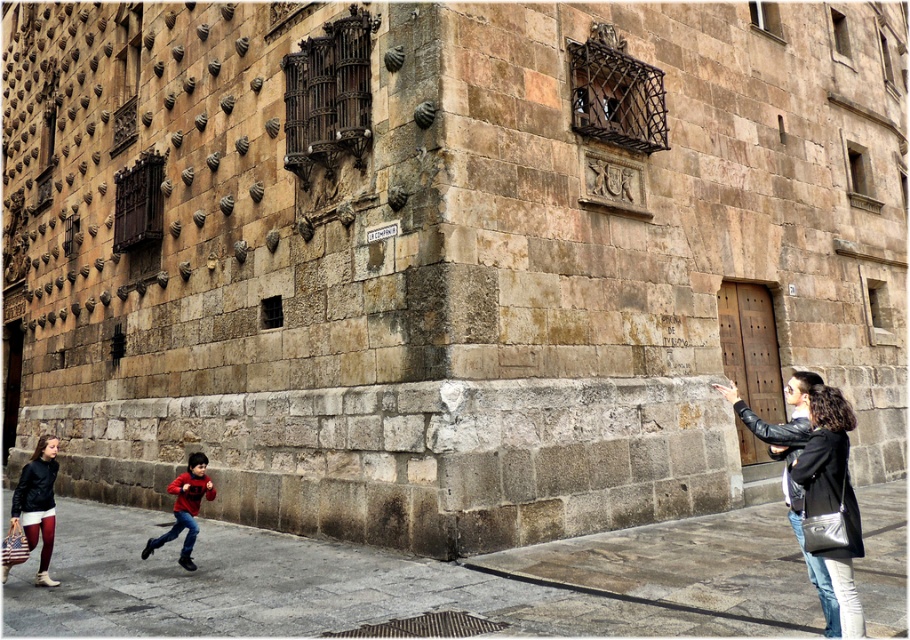
You are a delivery person trying to place a package between the leather jacket at lower right and the matte red sweater at lower left. Based on their thickness, can you fit the package in the space between them?

The leather jacket at lower right is thinner than the matte red sweater at lower left, so the space between them may be sufficient to fit the package depending on its size. However, without knowing the exact dimensions of the package, it is difficult to confirm.

You are standing in front of the historic stone building and notice two items at the lower left corner. Which item is closer to you, the matte black jacket at lower left or the matte red sweater at lower left?

The matte black jacket at lower left is closer to you because it is further to the viewer than the matte red sweater at lower left.